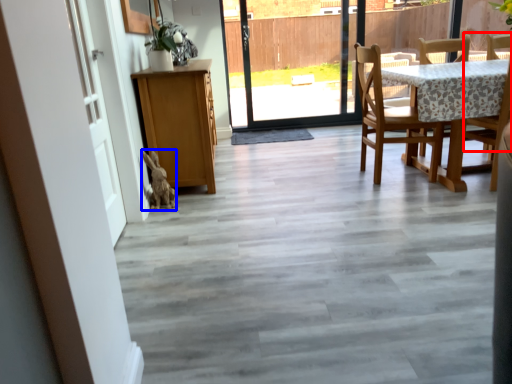
Question: Which object appears closest to the camera in this image, chair (highlighted by a red box) or animal (highlighted by a blue box)?

Choices:
 (A) chair
 (B) animal

Answer: (A)